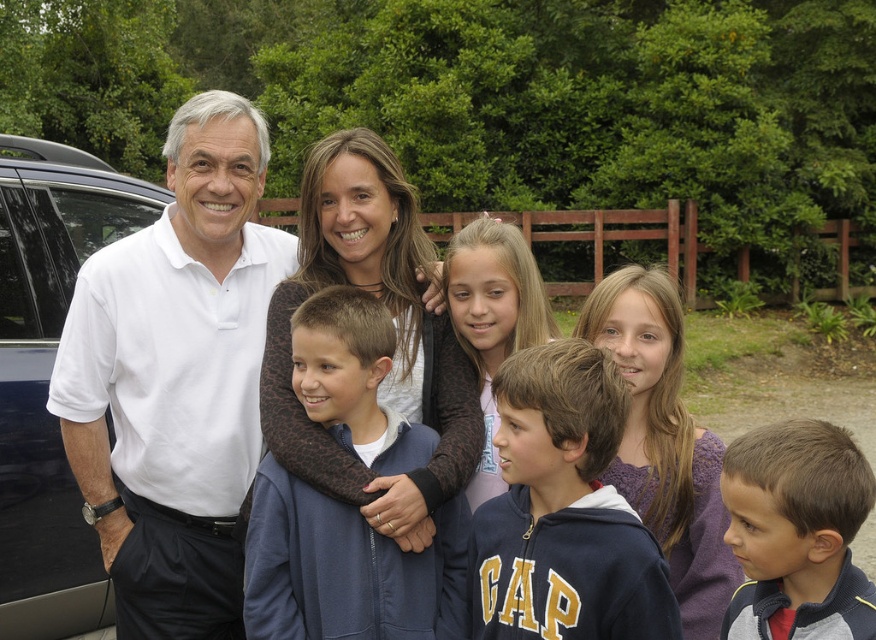
Which of these two, navy blue hoodie at center or smooth brown hair at center, stands shorter?

navy blue hoodie at center

You are a GUI agent. You are given a task and a screenshot of the screen. Output one action in this format:
    pyautogui.click(x=<x>, y=<y>)
    Task: Click on the navy blue hoodie at center
    Image resolution: width=876 pixels, height=640 pixels.
    Given the screenshot: What is the action you would take?
    pyautogui.click(x=563, y=512)

Is white cotton shirt at left further to the viewer compared to gray fleece jacket at center?

Yes, it is.

The image size is (876, 640). What do you see at coordinates (175, 378) in the screenshot?
I see `white cotton shirt at left` at bounding box center [175, 378].

Identify the location of white cotton shirt at left. Image resolution: width=876 pixels, height=640 pixels. (175, 378).

Is white cotton shirt at left wider than smooth brown hair at center?

Yes, white cotton shirt at left is wider than smooth brown hair at center.

Who is more forward, (108, 458) or (470, 250)?

Positioned in front is point (470, 250).

Which is behind, point (143, 320) or point (548, 324)?

The point (548, 324) is more distant.

Find the location of `white cotton shirt at left`. white cotton shirt at left is located at coordinates (175, 378).